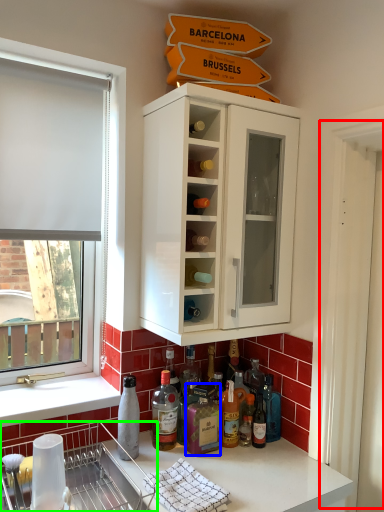
Question: Which is nearer to the screen door (highlighted by a red box)? bottle (highlighted by a blue box) or dish washer (highlighted by a green box).

Choices:
 (A) bottle
 (B) dish washer

Answer: (A)